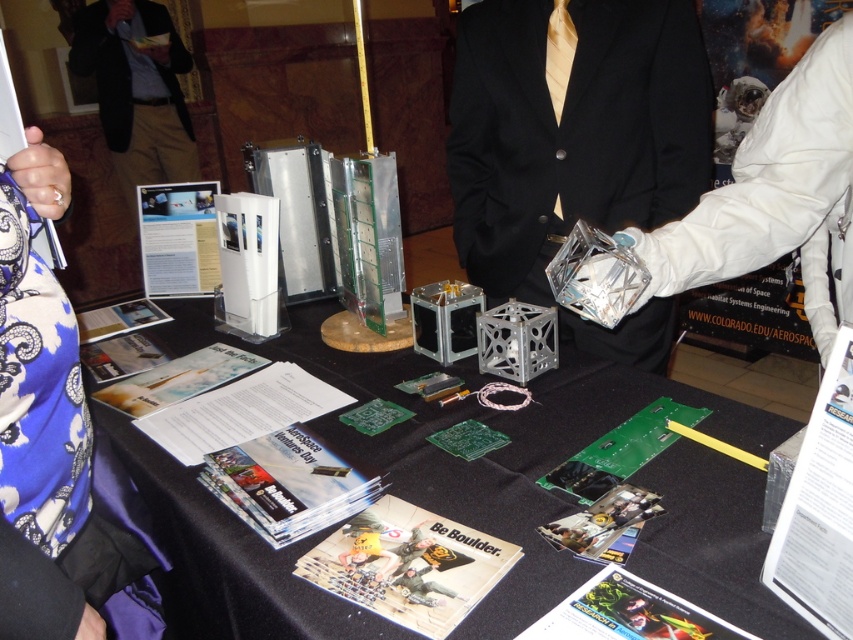
Question: Does black matte suit at center have a smaller size compared to white paper at upper left?

Choices:
 (A) yes
 (B) no

Answer: (B)

Question: Is green circuit board at center positioned behind black suit at upper center?

Choices:
 (A) no
 (B) yes

Answer: (A)

Question: Among these points, which one is farthest from the camera?

Choices:
 (A) (807, 444)
 (B) (158, 28)

Answer: (B)

Question: Estimate the real-world distances between objects in this image. Which object is farther from the white paper at upper left?

Choices:
 (A) black suit at upper center
 (B) white paper at center

Answer: (A)

Question: Which of these objects is positioned closest to the black matte suit at center?

Choices:
 (A) white paper at center
 (B) white paper at upper left

Answer: (B)

Question: Can you confirm if green circuit board at center is thinner than white paper at upper left?

Choices:
 (A) no
 (B) yes

Answer: (A)